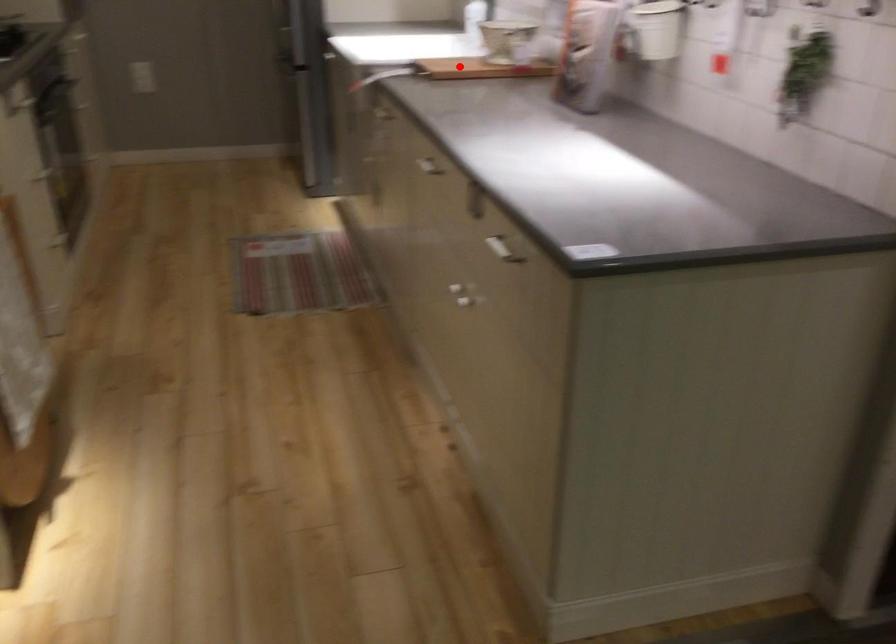
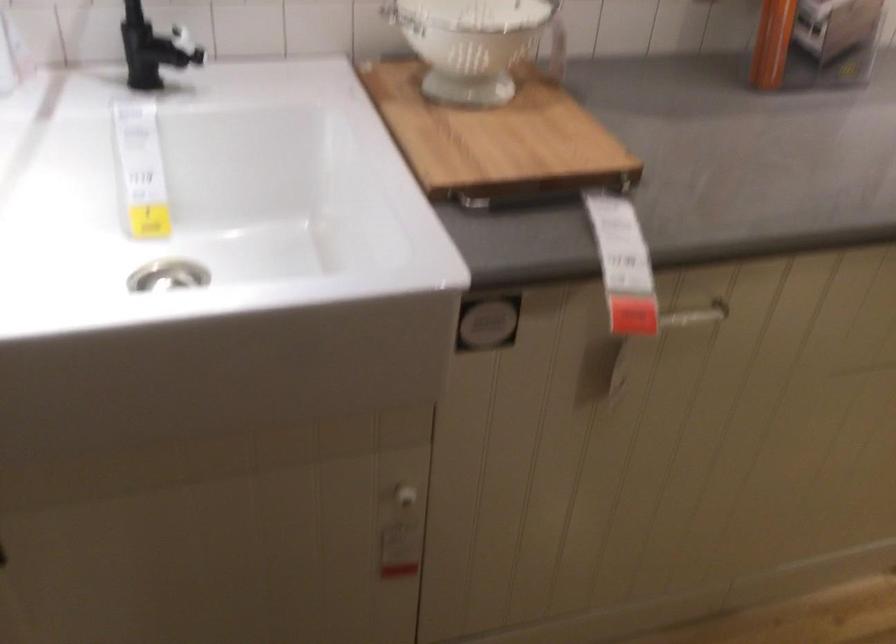
Find the pixel in the second image that matches the highlighted location in the first image.

(495, 138)